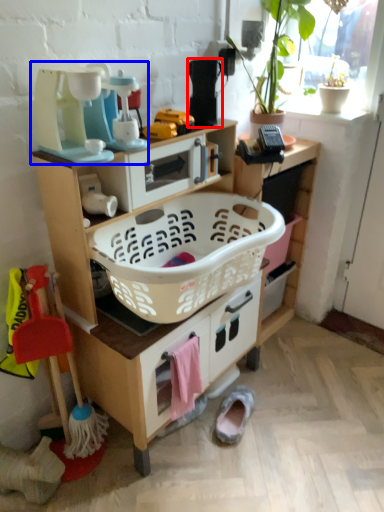
Question: Which object appears farthest to the camera in this image, appliance (highlighted by a red box) or appliance (highlighted by a blue box)?

Choices:
 (A) appliance
 (B) appliance

Answer: (A)